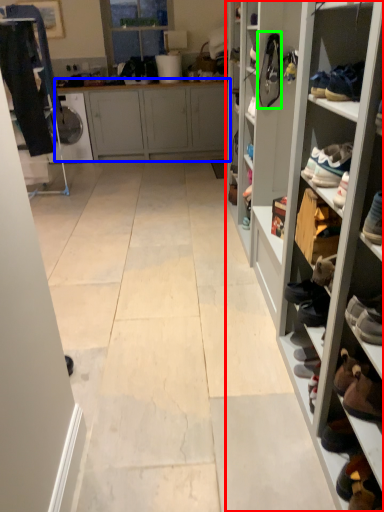
Question: Estimate the real-world distances between objects in this image. Which object is farther from shelf (highlighted by a red box), cabinetry (highlighted by a blue box) or shoe (highlighted by a green box)?

Choices:
 (A) cabinetry
 (B) shoe

Answer: (A)